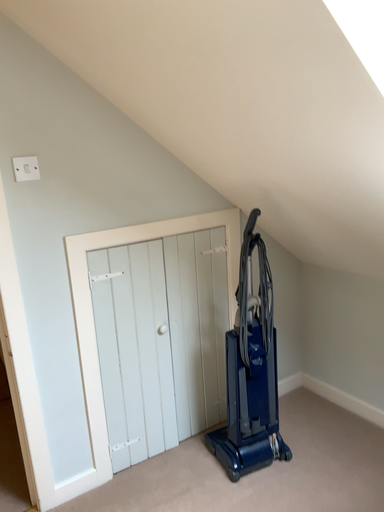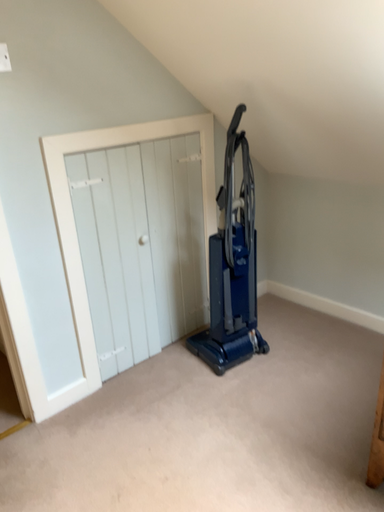
Question: How did the camera likely rotate when shooting the video?

Choices:
 (A) rotated upward
 (B) rotated downward

Answer: (B)